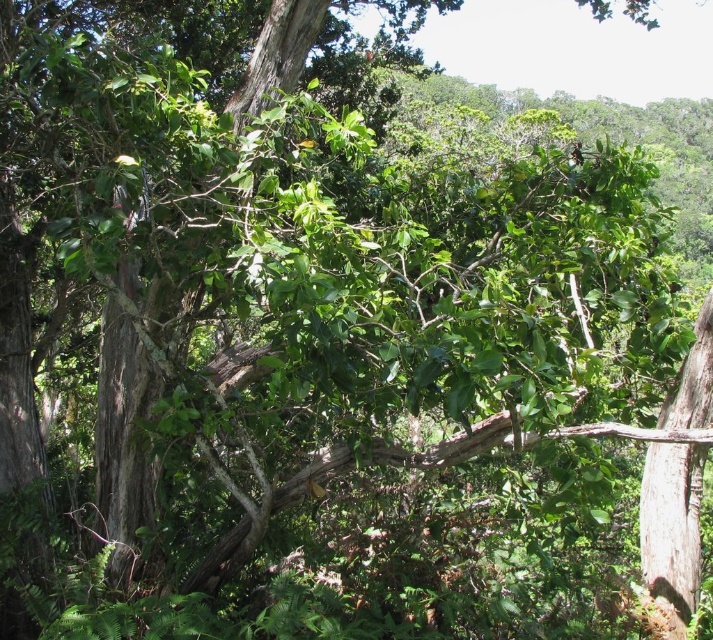
Measure the distance between brown rough tree trunk at center and camera.

brown rough tree trunk at center is 3.66 meters from camera.

Can you confirm if brown rough tree trunk at center is taller than smooth gray bark at right?

Incorrect, brown rough tree trunk at center's height is not larger of smooth gray bark at right's.

Does point (128, 390) come behind point (655, 504)?

Yes, it is.

At what (x,y) coordinates should I click in order to perform the action: click on brown rough tree trunk at center. Please return your answer as a coordinate pair (x, y). The height and width of the screenshot is (640, 713). Looking at the image, I should click on (125, 416).